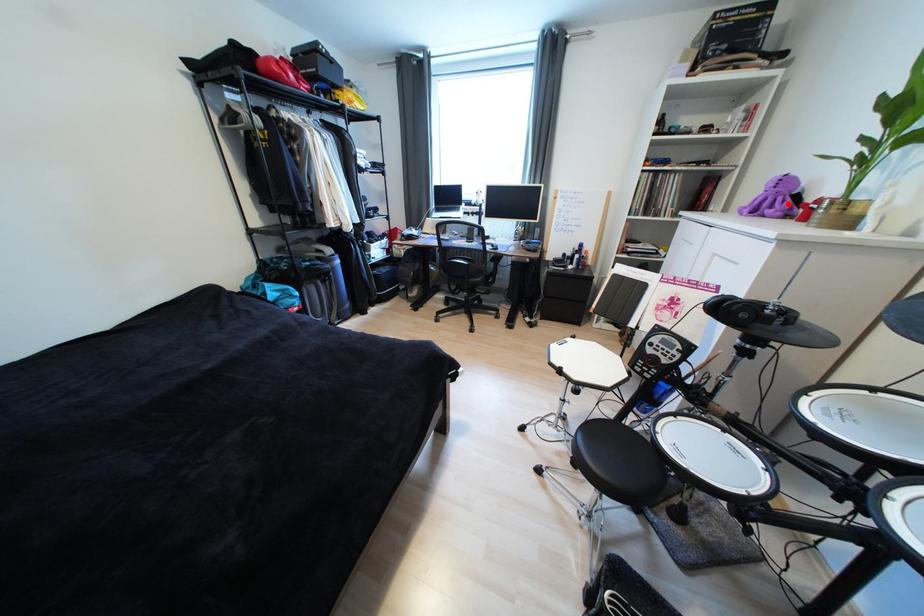
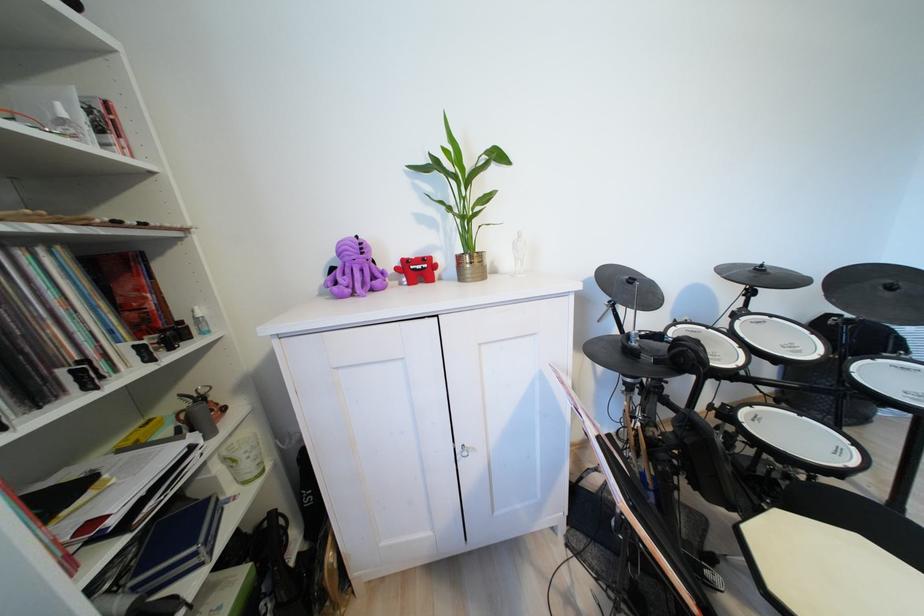
In the second image, find the point that corresponds to the highlighted location in the first image.

(360, 274)